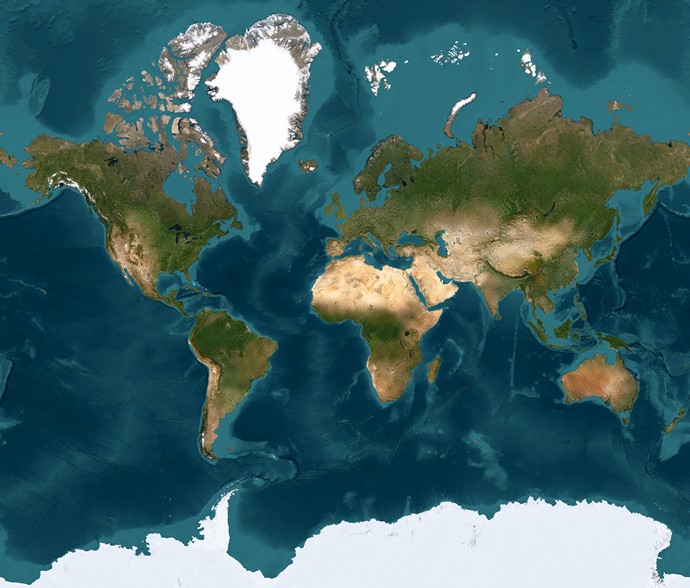
The width and height of the screenshot is (690, 588). In order to click on corner in this screenshot , I will do `click(680, 581)`, `click(688, 9)`, `click(12, 6)`, `click(19, 573)`.